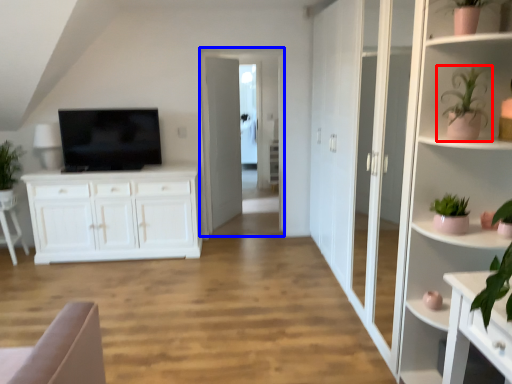
Question: Which object is closer to the camera taking this photo, houseplant (highlighted by a red box) or glass door (highlighted by a blue box)?

Choices:
 (A) houseplant
 (B) glass door

Answer: (A)